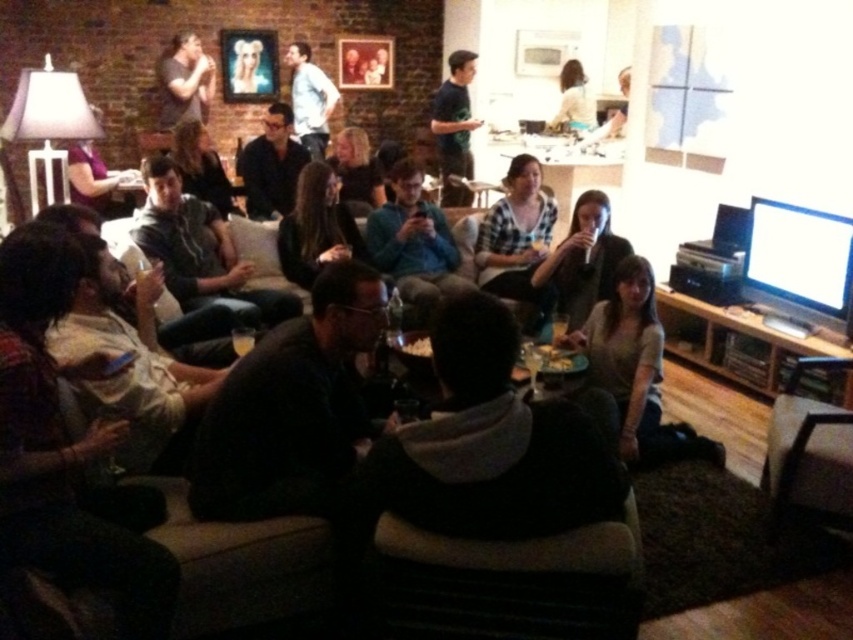
Question: Among these objects, which one is farthest from the camera?

Choices:
 (A) dark brown leather armchair at lower right
 (B) matte black microphone at center
 (C) matte black shirt at center
 (D) matte black shirt at upper left

Answer: (D)

Question: Which object is positioned closest to the dark brown hair at center?

Choices:
 (A) matte black shirt at center
 (B) matte black shirt at upper left
 (C) light brown hair at upper center

Answer: (A)

Question: Is dark brown leather jacket at center closer to the viewer compared to light brown hair at upper center?

Choices:
 (A) yes
 (B) no

Answer: (A)

Question: Is matte black microphone at center positioned behind matte black shirt at upper left?

Choices:
 (A) yes
 (B) no

Answer: (B)

Question: Is dark brown leather armchair at lower right closer to camera compared to light brown hair at upper center?

Choices:
 (A) no
 (B) yes

Answer: (B)

Question: Which point appears farthest from the camera in this image?

Choices:
 (A) (614, 259)
 (B) (283, 189)

Answer: (B)